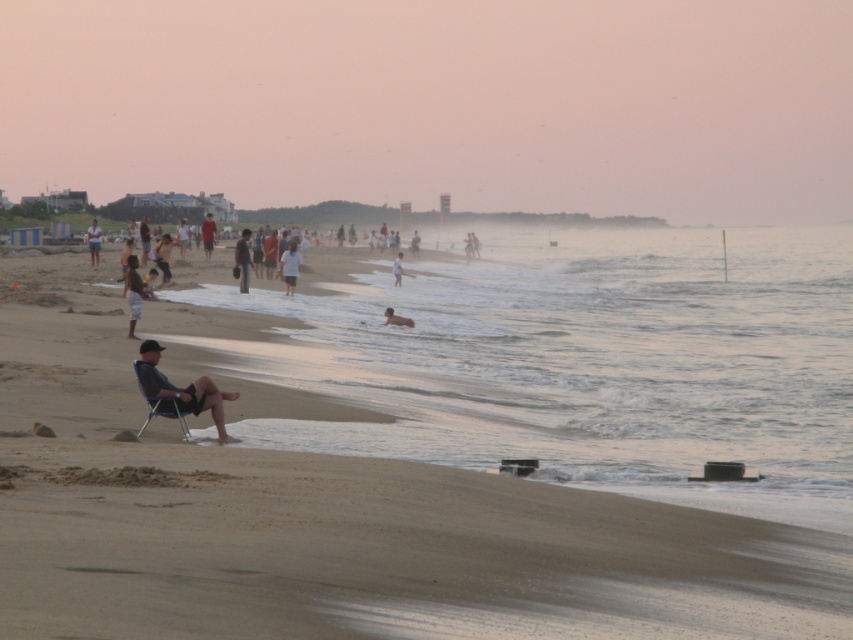
Question: Estimate the real-world distances between objects in this image. Which object is farther from the smooth skin child at center?

Choices:
 (A) light brown sand at center
 (B) dark blue shirt at center
 (C) sandy beach at lower left

Answer: (C)

Question: Can you confirm if dark blue fabric chair at lower left is bigger than light blue denim shorts at center?

Choices:
 (A) no
 (B) yes

Answer: (A)

Question: Among these points, which one is nearest to the camera?

Choices:
 (A) (163, 598)
 (B) (241, 269)

Answer: (A)

Question: Among these points, which one is nearest to the camera?

Choices:
 (A) (399, 285)
 (B) (206, 228)

Answer: (A)

Question: Can you confirm if sandy beach at lower left is thinner than blue plastic chair at center?

Choices:
 (A) no
 (B) yes

Answer: (A)

Question: Does light blue denim shorts at center come behind light brown sand at center?

Choices:
 (A) yes
 (B) no

Answer: (B)